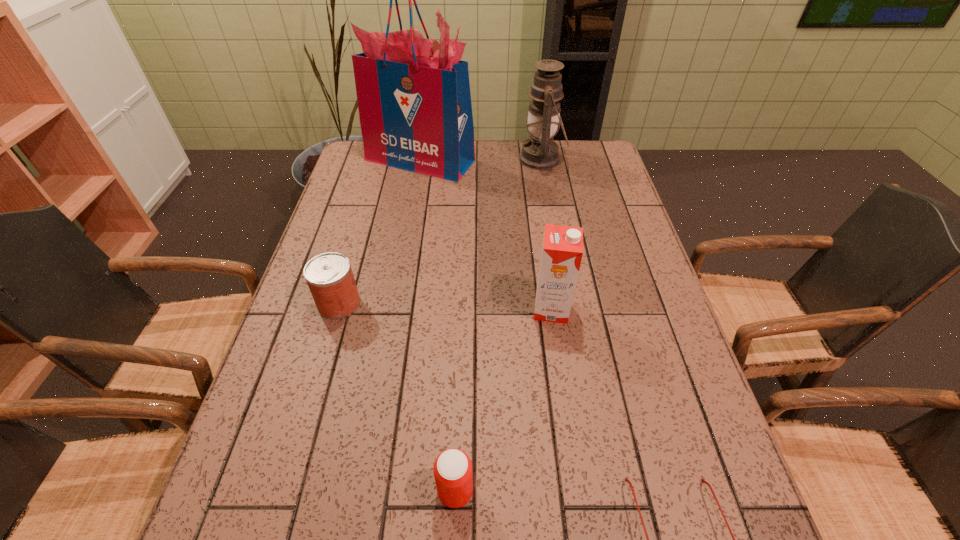
What are the coordinates of `free space at the far left corner of the desktop` in the screenshot? It's located at (378, 170).

I want to click on vacant space at the near right corner, so click(x=700, y=538).

Find the location of a particular element. This screenshot has height=540, width=960. blank region between the tallest object and the can is located at coordinates (379, 232).

You are a GUI agent. You are given a task and a screenshot of the screen. Output one action in this format:
    pyautogui.click(x=<x>, y=<y>)
    Task: Click on the empty space that is in between the beer can and the can
    
    Given the screenshot: What is the action you would take?
    pyautogui.click(x=397, y=397)

The width and height of the screenshot is (960, 540). What are the coordinates of `vacant area between the tallest object and the carton` in the screenshot? It's located at (486, 234).

I want to click on vacant point located between the beer can and the oil lamp, so click(498, 325).

Identify the location of unoccupied area between the beer can and the carton. The width and height of the screenshot is (960, 540). (503, 400).

Where is `free space that is in between the third tallest object and the can`? This screenshot has width=960, height=540. free space that is in between the third tallest object and the can is located at coordinates (445, 307).

Locate an element on the screen. The width and height of the screenshot is (960, 540). unoccupied position between the carton and the can is located at coordinates (445, 307).

I want to click on blank region between the grocery bag and the beer can, so click(x=438, y=326).